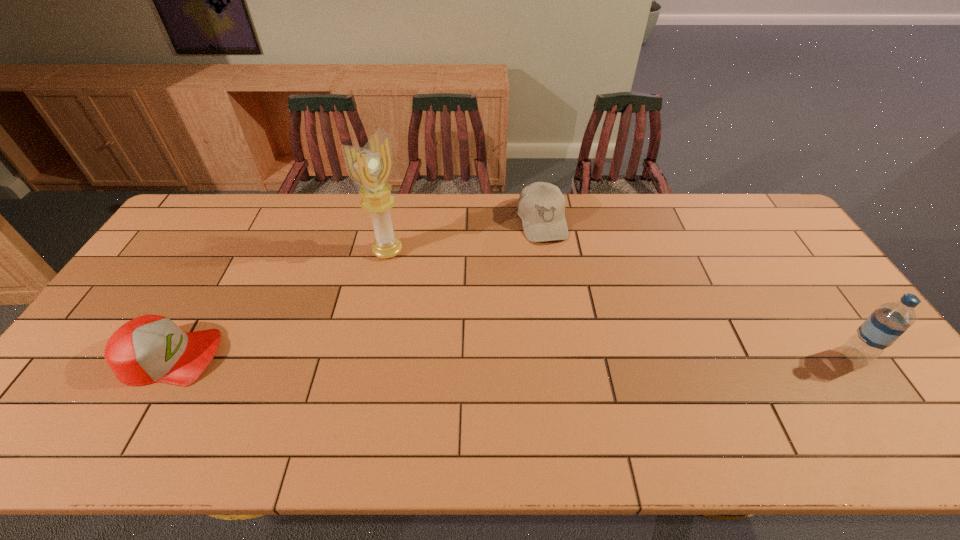
Find the location of a particular element. The height and width of the screenshot is (540, 960). free space that is in between the farther baseball cap and the left baseball cap is located at coordinates (356, 289).

At what (x,y) coordinates should I click in order to perform the action: click on vacant area between the third object from left to right and the nearer baseball cap. Please return your answer as a coordinate pair (x, y). This screenshot has width=960, height=540. Looking at the image, I should click on (356, 289).

Identify the location of vacant area between the farther baseball cap and the award. (465, 237).

Find the location of a particular element. free point between the right baseball cap and the leftmost object is located at coordinates (356, 289).

Find the location of `unoccupied position between the nearer baseball cap and the tallest object`. unoccupied position between the nearer baseball cap and the tallest object is located at coordinates (279, 304).

Locate an element on the screen. Image resolution: width=960 pixels, height=540 pixels. object that is the second closest to the nearer baseball cap is located at coordinates (541, 206).

Image resolution: width=960 pixels, height=540 pixels. I want to click on the third closest object relative to the right baseball cap, so click(151, 348).

Find the location of `free region that satisfies the following two spatial constraints: 1. on the front side of the tallest object; 2. on the label of the rightmost object`. free region that satisfies the following two spatial constraints: 1. on the front side of the tallest object; 2. on the label of the rightmost object is located at coordinates (366, 356).

Identify the location of vacant position in the image that satisfies the following two spatial constraints: 1. on the front side of the rightmost object; 2. on the label of the award. The width and height of the screenshot is (960, 540). (366, 356).